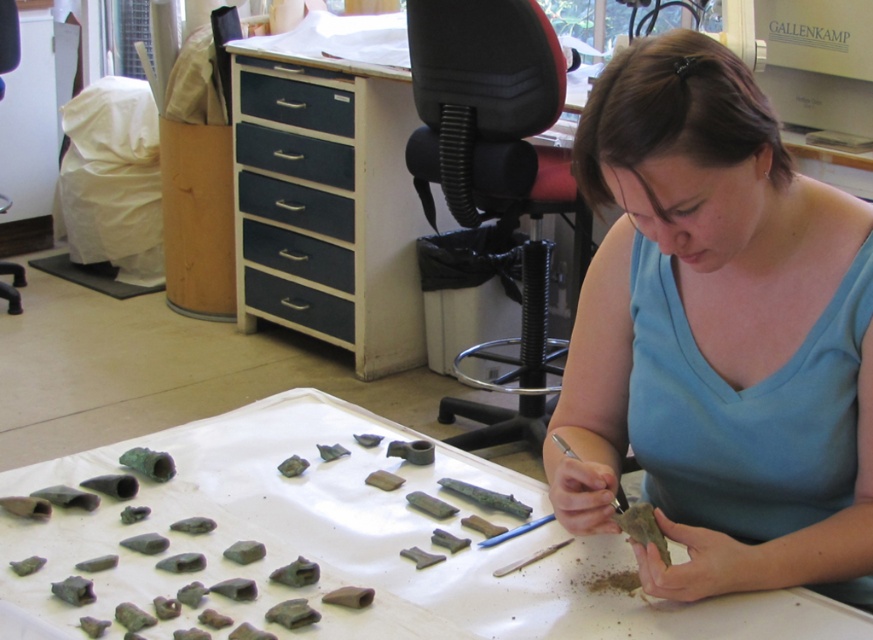
Question: Is blue fabric at center smaller than blue/grey wood drawer at center?

Choices:
 (A) yes
 (B) no

Answer: (B)

Question: Which of these objects is positioned closest to the blue painted wood drawer at center?

Choices:
 (A) blue fabric at center
 (B) dark gray matte drawer at upper center
 (C) green stone artifacts at center

Answer: (B)

Question: Is blue fabric at center below black matte drawer at center?

Choices:
 (A) yes
 (B) no

Answer: (A)

Question: Which point is closer to the camera?

Choices:
 (A) dark gray matte drawer at upper center
 (B) green stone artifacts at center
 (C) blue/grey wood drawer at center

Answer: (B)

Question: Which object is closer to the camera taking this photo?

Choices:
 (A) blue/grey wood drawer at center
 (B) green stone artifacts at center
 (C) dark gray matte drawer at upper center
 (D) blue fabric at center

Answer: (D)

Question: Is dark gray matte drawer at upper center closer to camera compared to blue painted wood drawer at center?

Choices:
 (A) yes
 (B) no

Answer: (A)